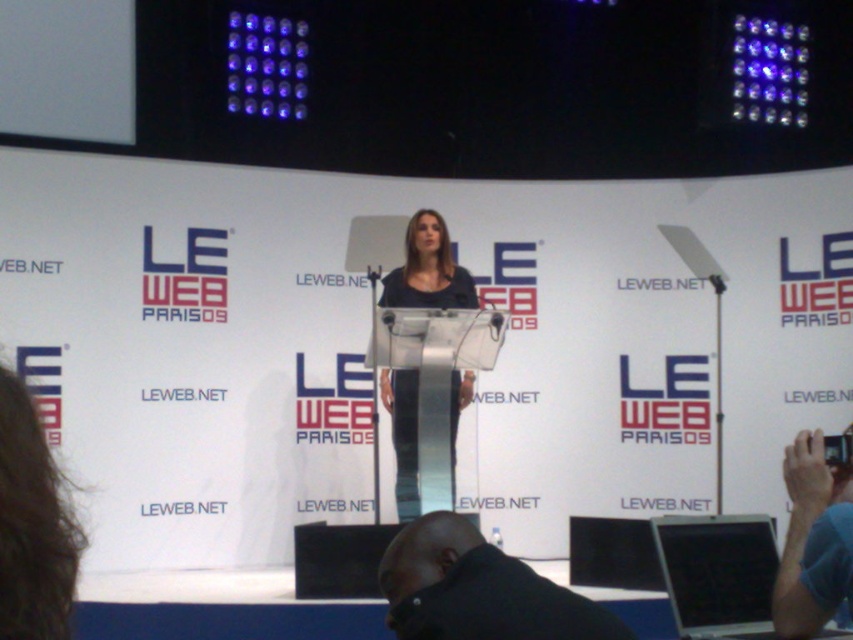
Between white plastic laptop at lower right and matte black dress at center, which one is positioned lower?

white plastic laptop at lower right

Consider the image. Between white plastic laptop at lower right and matte black dress at center, which one has less height?

white plastic laptop at lower right is shorter.

Which is behind, point (656, 541) or point (437, 262)?

The point (437, 262) is more distant.

At what (x,y) coordinates should I click in order to perform the action: click on white plastic laptop at lower right. Please return your answer as a coordinate pair (x, y). This screenshot has height=640, width=853. Looking at the image, I should click on (718, 573).

Does black matte shirt at lower center appear on the right side of matte black dress at center?

Yes, black matte shirt at lower center is to the right of matte black dress at center.

Is black matte shirt at lower center closer to the viewer compared to matte black dress at center?

Yes, it is in front of matte black dress at center.

Is point (508, 586) closer to camera compared to point (398, 426)?

Yes.

Locate an element on the screen. The width and height of the screenshot is (853, 640). black matte shirt at lower center is located at coordinates (479, 589).

Between black matte shirt at lower center and white plastic laptop at lower right, which one has less height?

Standing shorter between the two is black matte shirt at lower center.

Who is taller, black matte shirt at lower center or white plastic laptop at lower right?

white plastic laptop at lower right is taller.

Is point (416, 563) positioned before point (747, 556)?

Yes, point (416, 563) is in front of point (747, 556).

This screenshot has height=640, width=853. What are the coordinates of `black matte shirt at lower center` in the screenshot? It's located at (479, 589).